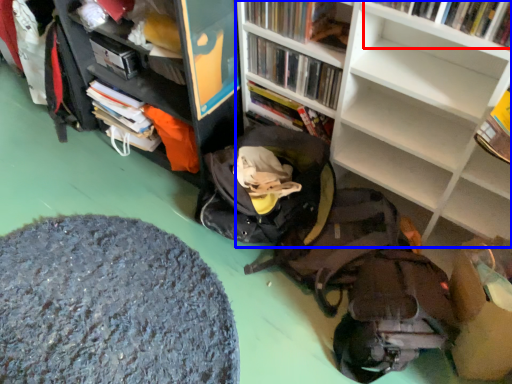
Question: Among these objects, which one is farthest to the camera, book (highlighted by a red box) or bookcase (highlighted by a blue box)?

Choices:
 (A) book
 (B) bookcase

Answer: (A)